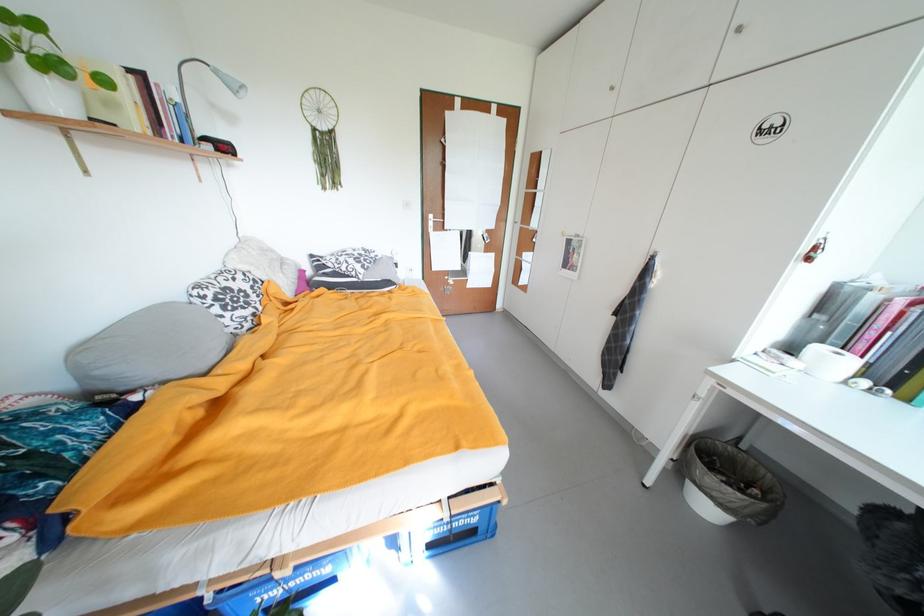
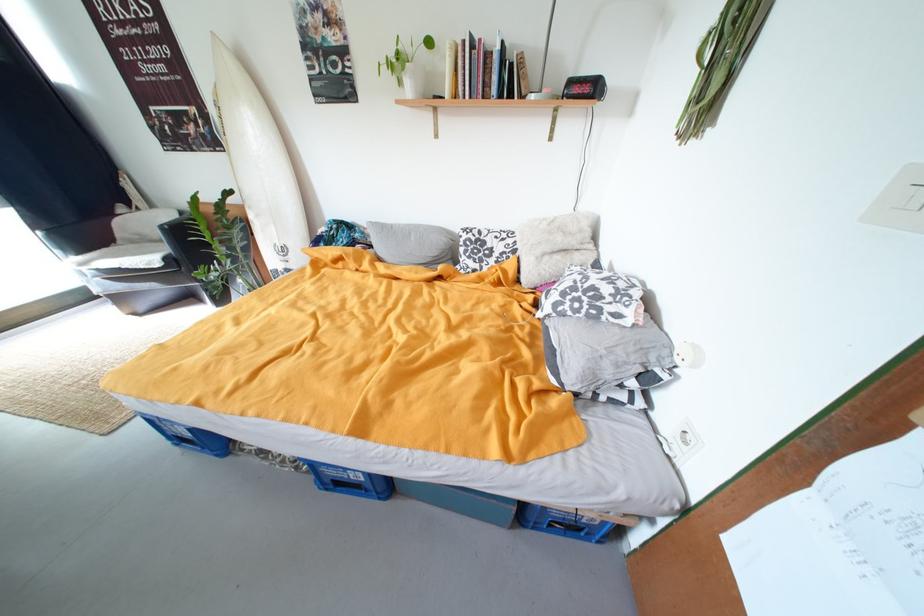
In the second image, find the point that corresponds to (371,269) in the first image.

(564, 306)